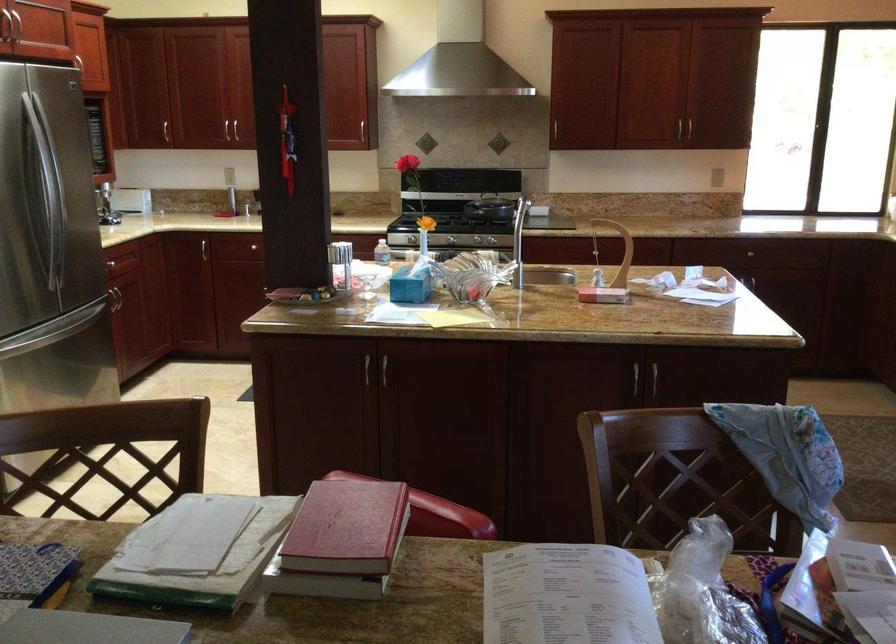
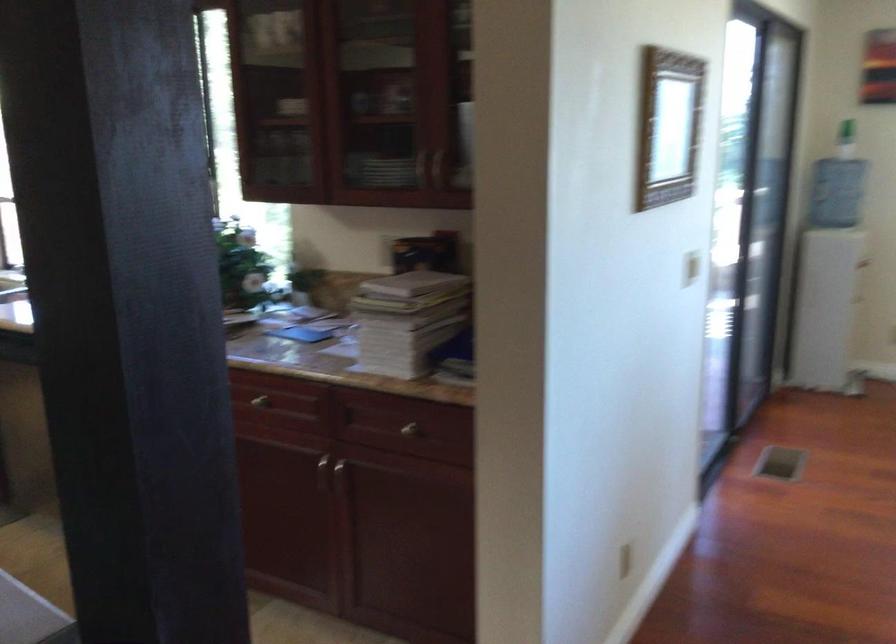
Question: The camera is either moving clockwise (left) or counter-clockwise (right) around the object. The first image is from the beginning of the video and the second image is from the end. Is the camera moving left or right when shooting the video?

Choices:
 (A) Left
 (B) Right

Answer: (A)